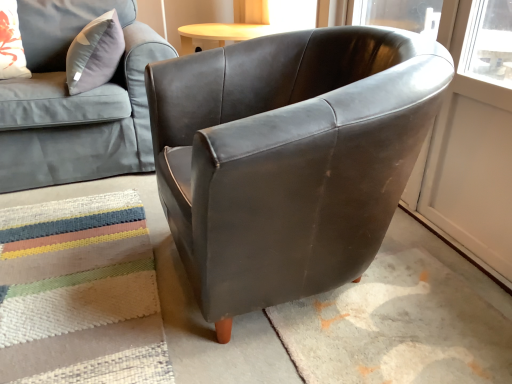
Question: From a real-world perspective, is matte gray fabric couch at upper left beneath matte brown leather armchair at center?

Choices:
 (A) yes
 (B) no

Answer: (B)

Question: Is the position of matte gray fabric couch at upper left more distant than that of matte brown leather armchair at center?

Choices:
 (A) no
 (B) yes

Answer: (B)

Question: Does matte gray fabric couch at upper left appear on the right side of matte brown leather armchair at center?

Choices:
 (A) yes
 (B) no

Answer: (B)

Question: Could you tell me if matte gray fabric couch at upper left is facing matte brown leather armchair at center?

Choices:
 (A) yes
 (B) no

Answer: (A)

Question: Is matte gray fabric couch at upper left positioned beyond the bounds of matte brown leather armchair at center?

Choices:
 (A) no
 (B) yes

Answer: (B)

Question: Considering the positions of matte brown leather armchair at center and textured woven mat at lower left in the image, is matte brown leather armchair at center bigger or smaller than textured woven mat at lower left?

Choices:
 (A) small
 (B) big

Answer: (B)

Question: Is matte brown leather armchair at center taller or shorter than textured woven mat at lower left?

Choices:
 (A) tall
 (B) short

Answer: (A)

Question: From a real-world perspective, is matte brown leather armchair at center physically located above or below textured woven mat at lower left?

Choices:
 (A) below
 (B) above

Answer: (B)

Question: Is matte brown leather armchair at center to the left or to the right of textured woven mat at lower left in the image?

Choices:
 (A) left
 (B) right

Answer: (B)

Question: Considering their positions, is matte brown leather armchair at center located in front of or behind floral fabric pillow at upper left?

Choices:
 (A) front
 (B) behind

Answer: (A)

Question: Considering the positions of point (310, 125) and point (4, 64), is point (310, 125) closer or farther from the camera than point (4, 64)?

Choices:
 (A) closer
 (B) farther

Answer: (A)

Question: Is matte brown leather armchair at center spatially inside floral fabric pillow at upper left, or outside of it?

Choices:
 (A) inside
 (B) outside

Answer: (B)

Question: Considering the positions of matte brown leather armchair at center and floral fabric pillow at upper left in the image, is matte brown leather armchair at center bigger or smaller than floral fabric pillow at upper left?

Choices:
 (A) small
 (B) big

Answer: (B)

Question: Is textured woven mat at lower left to the left or to the right of floral fabric pillow at upper left in the image?

Choices:
 (A) right
 (B) left

Answer: (A)

Question: From the image's perspective, is textured woven mat at lower left located above or below floral fabric pillow at upper left?

Choices:
 (A) below
 (B) above

Answer: (A)